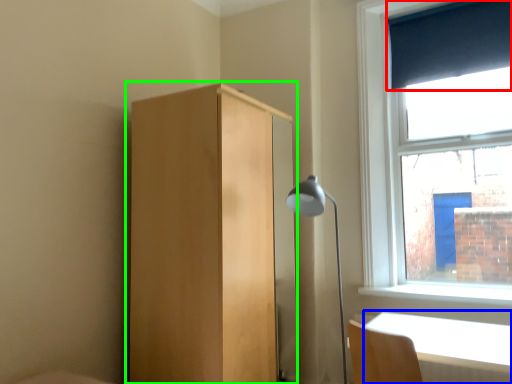
Question: Based on their relative distances, which object is nearer to curtain (highlighted by a red box)? Choose from table (highlighted by a blue box) and dresser (highlighted by a green box).

Choices:
 (A) table
 (B) dresser

Answer: (B)